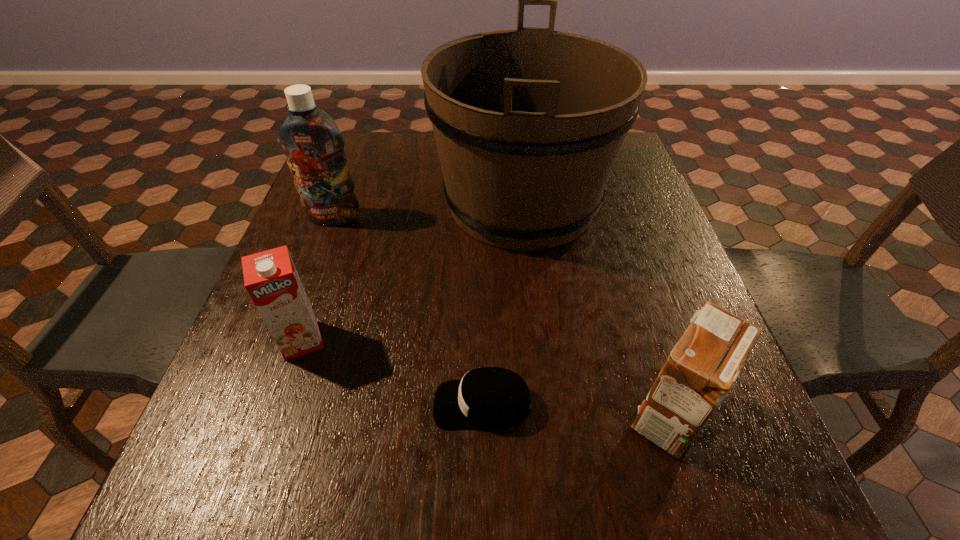
This screenshot has width=960, height=540. In order to click on vacant space located on the straw side of the nearer carton in this screenshot , I will do `click(391, 416)`.

Where is `vacant region located on the back of the farther carton`? This screenshot has width=960, height=540. vacant region located on the back of the farther carton is located at coordinates (323, 280).

The width and height of the screenshot is (960, 540). Find the location of `free spot located on the front-facing side of the cap`. free spot located on the front-facing side of the cap is located at coordinates (x=238, y=404).

Where is `free point located 0.180m on the front-facing side of the cap`? This screenshot has width=960, height=540. free point located 0.180m on the front-facing side of the cap is located at coordinates (327, 404).

What are the coordinates of `free space located 0.270m on the front-facing side of the cap` in the screenshot? It's located at (274, 404).

In order to click on object positioned at the far edge in this screenshot , I will do `click(528, 123)`.

Where is `shampoo at the left edge`? This screenshot has width=960, height=540. shampoo at the left edge is located at coordinates (313, 144).

Image resolution: width=960 pixels, height=540 pixels. What are the coordinates of `carton that is positioned at the left edge` in the screenshot? It's located at (270, 277).

Where is `bucket that is at the right edge`? bucket that is at the right edge is located at coordinates (528, 123).

Identify the location of carton situated at the right edge. (701, 369).